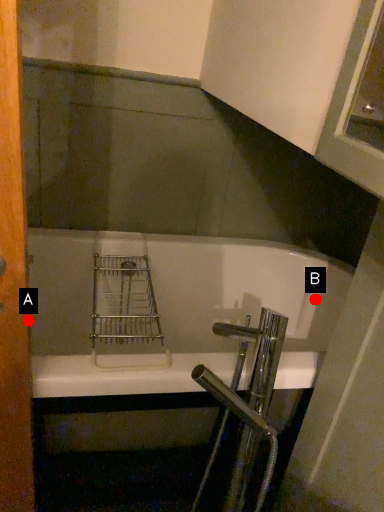
Question: Two points are circled on the image, labeled by A and B beside each circle. Which point is closer to the camera?

Choices:
 (A) A is closer
 (B) B is closer

Answer: (A)